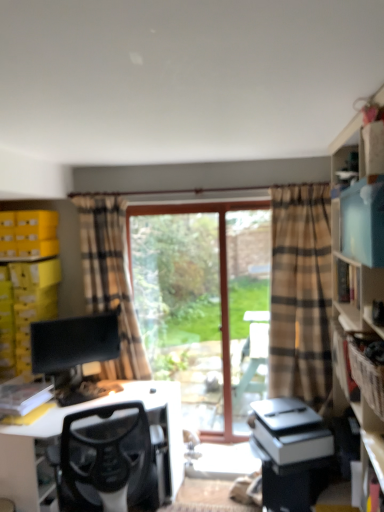
Question: Is clear glass window at center located within brown cardboard crate at right?

Choices:
 (A) no
 (B) yes

Answer: (A)

Question: Is brown cardboard crate at right far from clear glass window at center?

Choices:
 (A) no
 (B) yes

Answer: (B)

Question: From a real-world perspective, is brown cardboard crate at right over clear glass window at center?

Choices:
 (A) yes
 (B) no

Answer: (A)

Question: Is brown cardboard crate at right thinner than clear glass window at center?

Choices:
 (A) no
 (B) yes

Answer: (A)

Question: Is brown cardboard crate at right at the left side of clear glass window at center?

Choices:
 (A) yes
 (B) no

Answer: (B)

Question: In terms of size, does beige plaid curtain at left appear bigger or smaller than wooden screen door at center?

Choices:
 (A) big
 (B) small

Answer: (A)

Question: Visually, is beige plaid curtain at left positioned to the left or to the right of wooden screen door at center?

Choices:
 (A) left
 (B) right

Answer: (A)

Question: Which is correct: beige plaid curtain at left is inside wooden screen door at center, or outside of it?

Choices:
 (A) inside
 (B) outside

Answer: (B)

Question: Is beige plaid curtain at left wider or thinner than wooden screen door at center?

Choices:
 (A) thin
 (B) wide

Answer: (B)

Question: Is clear glass window at center to the left or to the right of matte black monitor at left in the image?

Choices:
 (A) left
 (B) right

Answer: (B)

Question: From a real-world perspective, is clear glass window at center positioned above or below matte black monitor at left?

Choices:
 (A) above
 (B) below

Answer: (A)

Question: In terms of height, does clear glass window at center look taller or shorter compared to matte black monitor at left?

Choices:
 (A) tall
 (B) short

Answer: (A)

Question: Considering the positions of clear glass window at center and matte black monitor at left in the image, is clear glass window at center bigger or smaller than matte black monitor at left?

Choices:
 (A) big
 (B) small

Answer: (A)

Question: Based on their sizes in the image, would you say black mesh chair at lower left is bigger or smaller than yellow cardboard boxes at left, the second shelf viewed from the front?

Choices:
 (A) big
 (B) small

Answer: (A)

Question: In terms of height, does black mesh chair at lower left look taller or shorter compared to yellow cardboard boxes at left, which ranks as the 1th shelf in left-to-right order?

Choices:
 (A) tall
 (B) short

Answer: (A)